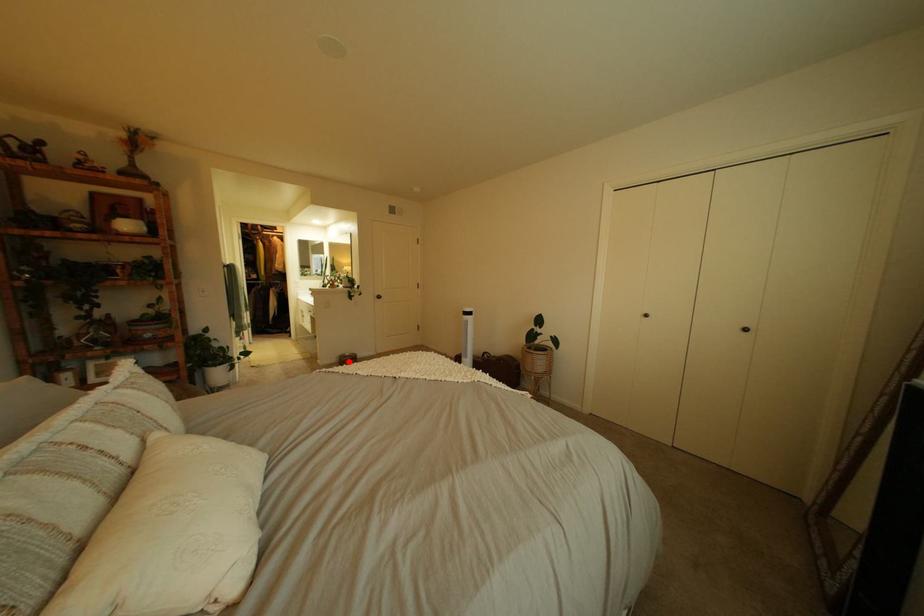
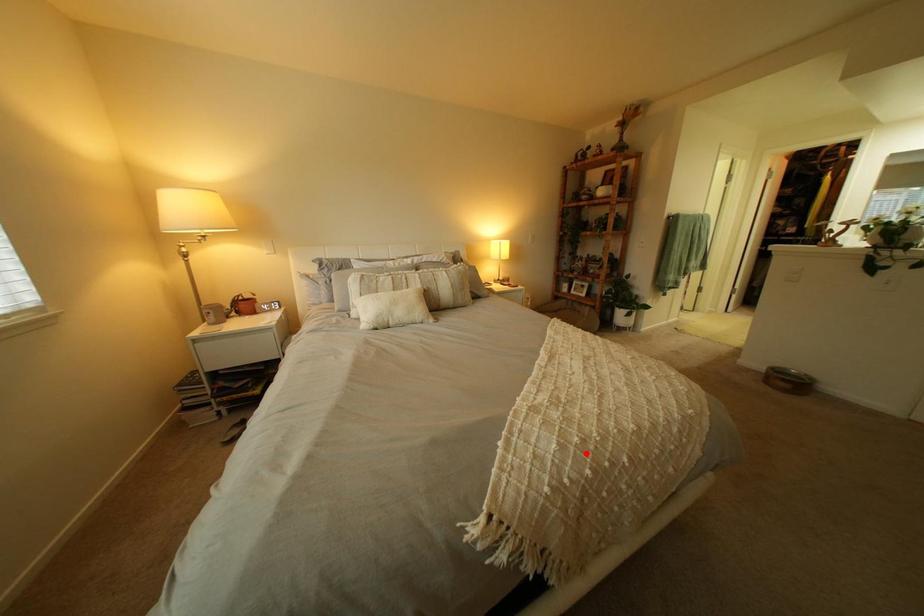
I am providing you with two images of the same scene from different viewpoints. A red point is marked on the first image and another point is marked on the second image. Is the marked point in image1 the same physical position as the marked point in image2?

No